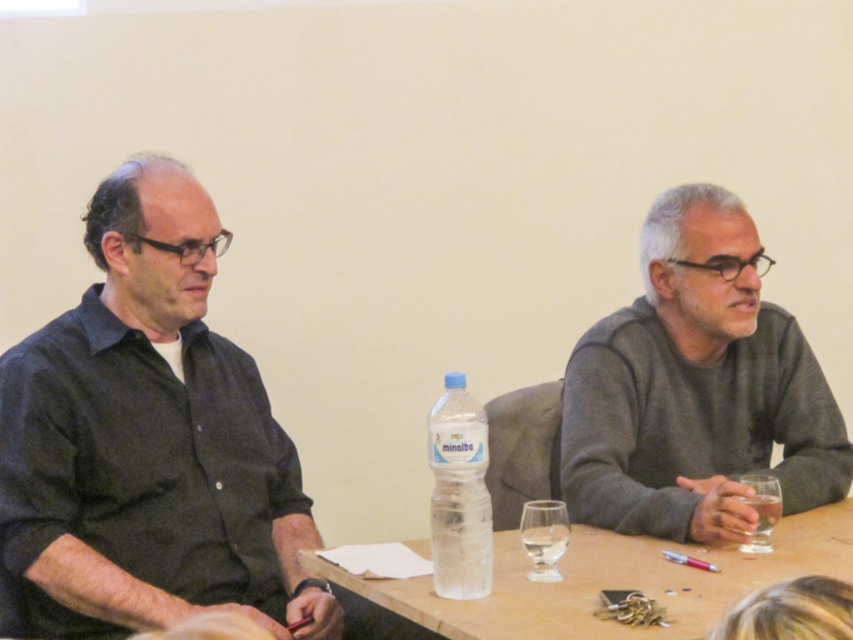
You are a photographer wanting to capture a candid shot of both individuals without moving any objects. Since the gray sweater at right and the clear plastic bottle at center are in the foreground, which object might block the view of the person on the right?

The gray sweater at right has a greater height compared to the clear plastic bottle at center, so the gray sweater at right is more likely to block the view of the person on the right.

What is the 2D coordinate of the clear plastic table at center?

The clear plastic table at center is located at the 2D coordinate point of (611, 580).